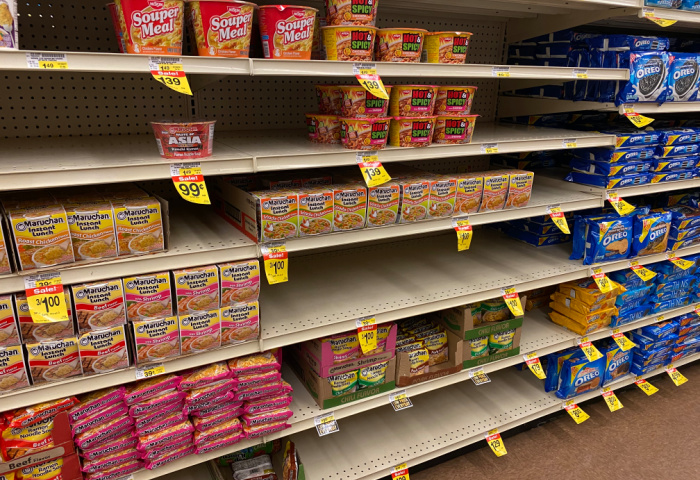
Find the location of a particular element. This screenshot has height=480, width=700. items on second from the top shelf is located at coordinates tap(187, 143), tap(325, 124), tap(328, 97), tap(371, 128), tap(369, 110), tap(409, 99), tap(423, 130), tap(465, 94), tap(463, 127).